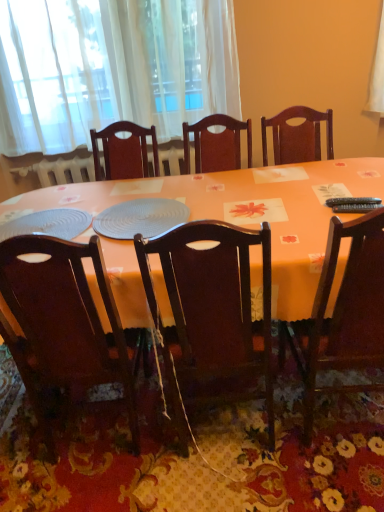
At what (x,y) coordinates should I click in order to perform the action: click on vacant area that lies between dark wood chair at center, marked as the 2th chair in a right-to-left arrangement, and wooden chair at right, which is the first chair in right-to-left order. Please return your answer as a coordinate pair (x, y). The width and height of the screenshot is (384, 512). Looking at the image, I should click on (288, 423).